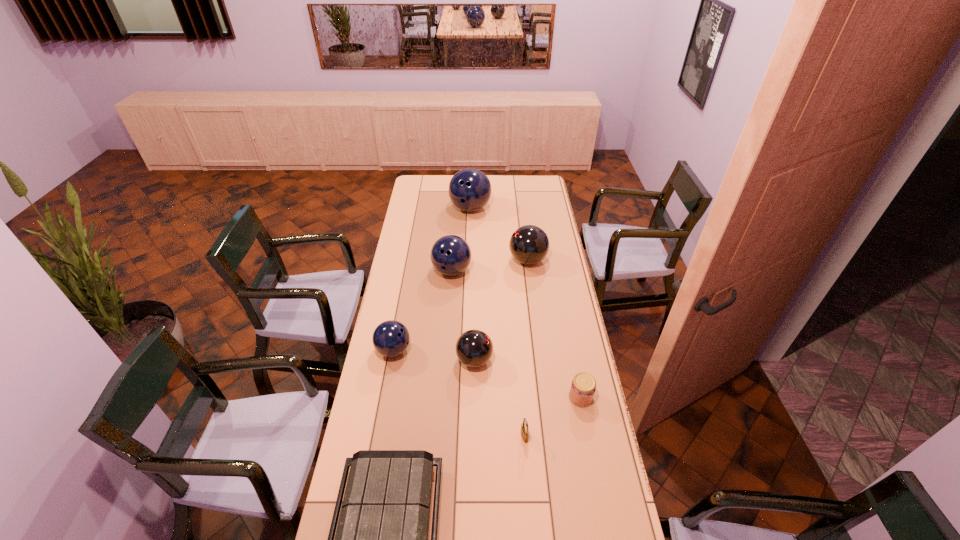
Find the location of a particular element. red jam is located at coordinates [582, 390].

Locate an element on the screen. The image size is (960, 540). brass padlock is located at coordinates (524, 427).

At what (x,y) coordinates should I click in order to perform the action: click on the second nearest object. Please return your answer as a coordinate pair (x, y). Looking at the image, I should click on (524, 427).

The height and width of the screenshot is (540, 960). Find the location of `vacant space located 0.390m on the surface of the farthest blue bowling ball near the finger holes`. vacant space located 0.390m on the surface of the farthest blue bowling ball near the finger holes is located at coordinates (468, 266).

At what (x,y) coordinates should I click in order to perform the action: click on vacant space positioned on the surface of the rightmost bowling ball near the finger holes. Please return your answer as a coordinate pair (x, y). Looking at the image, I should click on (434, 260).

Find the location of a particular element. free space located on the surface of the rightmost bowling ball near the finger holes is located at coordinates (x=454, y=260).

Locate an element on the screen. This screenshot has width=960, height=540. free space located on the surface of the rightmost bowling ball near the finger holes is located at coordinates (447, 260).

Where is `free space located on the surface of the second biggest blue bowling ball near the finger holes`? This screenshot has height=540, width=960. free space located on the surface of the second biggest blue bowling ball near the finger holes is located at coordinates (449, 305).

I want to click on vacant space located on the surface of the leftmost blue bowling ball near the finger holes, so click(449, 350).

Image resolution: width=960 pixels, height=540 pixels. I want to click on vacant space situated 0.240m on the surface of the left black bowling ball near the finger holes, so click(x=554, y=360).